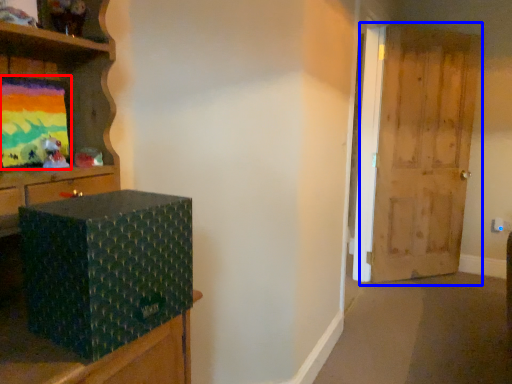
Question: Which object is closer to the camera taking this photo, picture frame (highlighted by a red box) or door (highlighted by a blue box)?

Choices:
 (A) picture frame
 (B) door

Answer: (A)